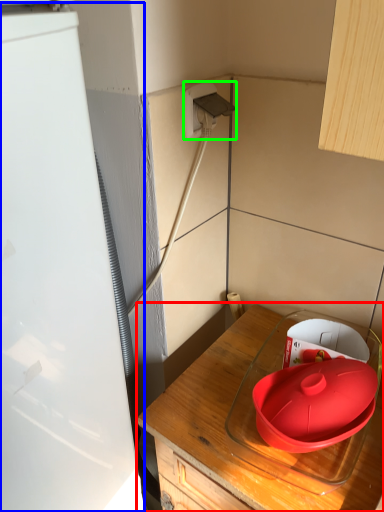
Question: Based on their relative distances, which object is nearer to countertop (highlighted by a red box)? Choose from appliance (highlighted by a blue box) and electric outlet (highlighted by a green box).

Choices:
 (A) appliance
 (B) electric outlet

Answer: (A)